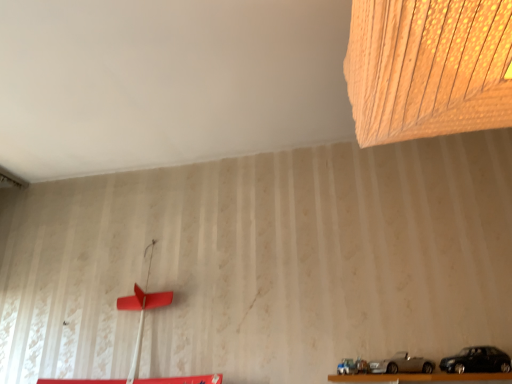
Question: From the image's perspective, relative to wooden textured lampshade at upper right, is black matte car at lower right, the second car when ordered from left to right, above or below?

Choices:
 (A) below
 (B) above

Answer: (A)

Question: Considering the positions of black matte car at lower right, which appears as the 1th car when viewed from the right, and wooden textured lampshade at upper right in the image, is black matte car at lower right, which appears as the 1th car when viewed from the right, wider or thinner than wooden textured lampshade at upper right?

Choices:
 (A) wide
 (B) thin

Answer: (B)

Question: Which of these objects is positioned closest to the silver metallic car at lower center, which is the first car in left-to-right order?

Choices:
 (A) black matte car at lower right, which appears as the 1th car when viewed from the right
 (B) wooden textured lampshade at upper right

Answer: (A)

Question: Considering the real-world distances, which object is farthest from the wooden textured lampshade at upper right?

Choices:
 (A) silver metallic car at lower center, which is the first car in left-to-right order
 (B) black matte car at lower right, which appears as the 1th car when viewed from the right

Answer: (A)